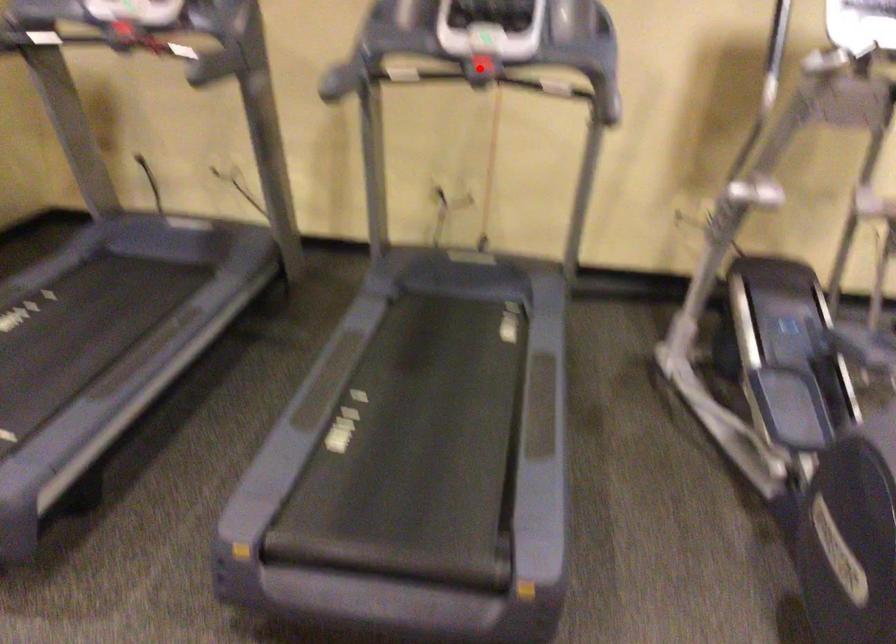
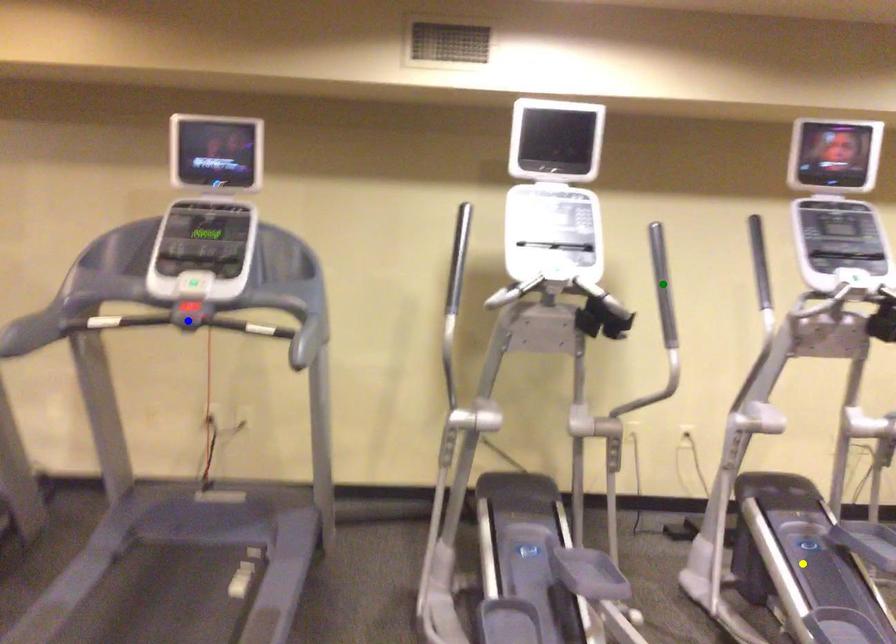
Question: I am providing you with two images of the same scene from different viewpoints. A red point is marked on the first image. You are given multiple points on the second image. Which spot in image 2 lines up with the point in image 1?

Choices:
 (A) green point
 (B) yellow point
 (C) blue point

Answer: (C)